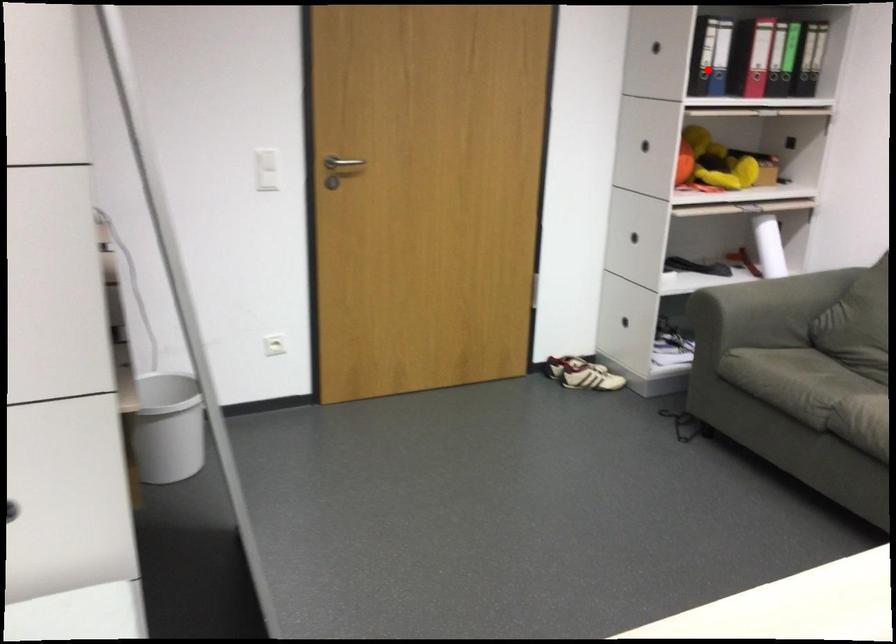
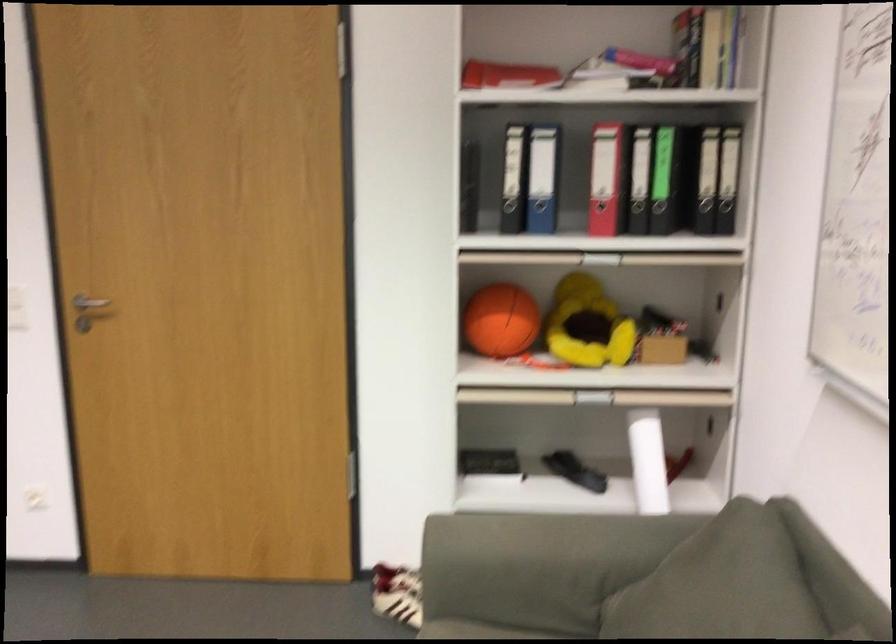
Find the pixel in the second image that matches the highlighted location in the first image.

(539, 216)